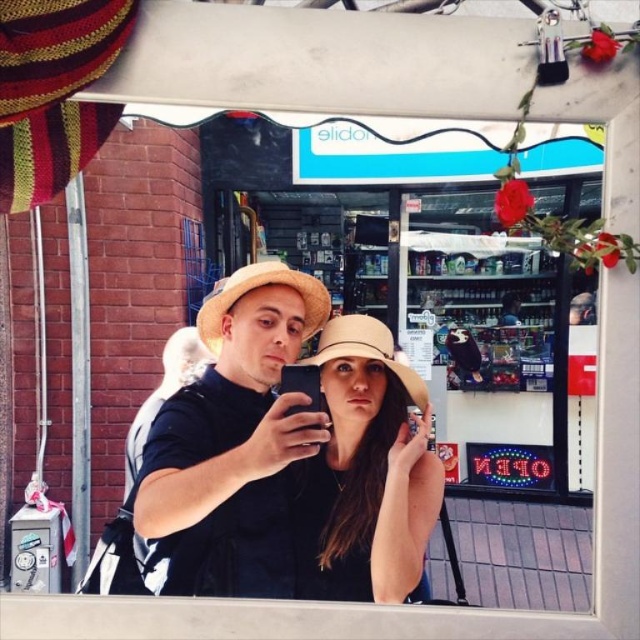
Who is lower down, matte straw hats at center or beige woven hat at center?

beige woven hat at center is below.

How much distance is there between matte straw hats at center and beige woven hat at center?

matte straw hats at center is 7.94 centimeters from beige woven hat at center.

At what (x,y) coordinates should I click in order to perform the action: click on matte straw hats at center. Please return your answer as a coordinate pair (x, y). The width and height of the screenshot is (640, 640). Looking at the image, I should click on (291, 456).

You are a GUI agent. You are given a task and a screenshot of the screen. Output one action in this format:
    pyautogui.click(x=<x>, y=<y>)
    Task: Click on the matte straw hats at center
    
    Given the screenshot: What is the action you would take?
    pyautogui.click(x=291, y=456)